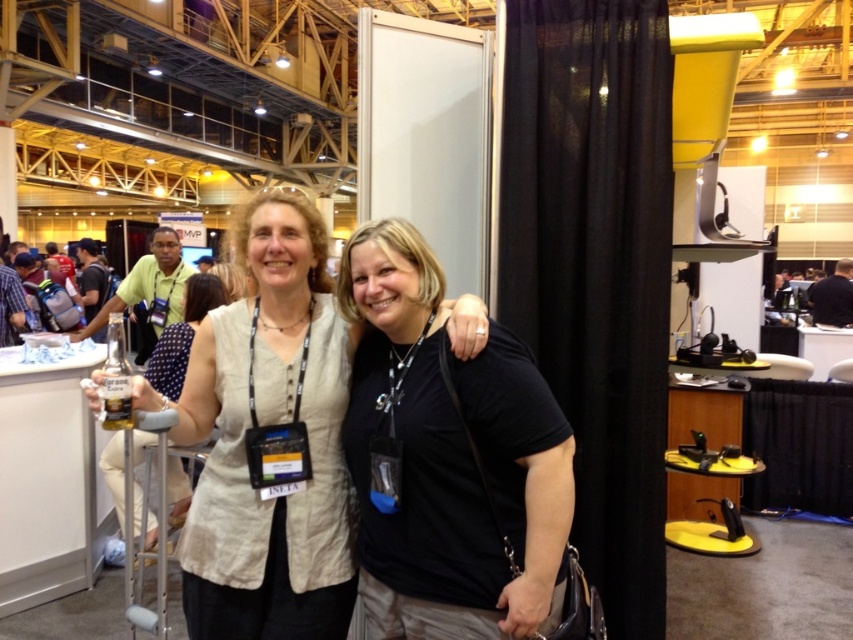
Question: Which point is closer to the camera?

Choices:
 (A) (367, 224)
 (B) (811, 291)
 (C) (91, 316)
 (D) (561, 109)

Answer: (A)

Question: Can you confirm if light blue shirt at center is positioned above black fabric shirt at upper right?

Choices:
 (A) yes
 (B) no

Answer: (B)

Question: Which object is closer to the camera taking this photo?

Choices:
 (A) black fabric curtain at center
 (B) black fabric shirt at upper right
 (C) light beige fabric shirt at center

Answer: (C)

Question: Which point is closer to the camera taking this photo?

Choices:
 (A) (161, 356)
 (B) (368, 225)

Answer: (B)

Question: Is black matte shirt at center smaller than light blue shirt at center?

Choices:
 (A) yes
 (B) no

Answer: (A)

Question: Is translucent plastic bottle at left above light blue shirt at center?

Choices:
 (A) no
 (B) yes

Answer: (A)